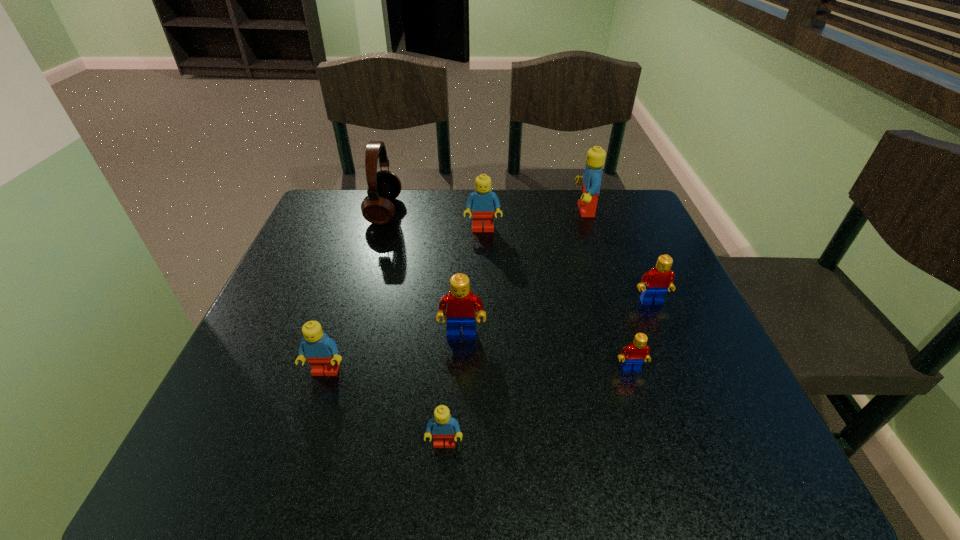
Where is `free space between the black headset and the leftmost red Lego`? free space between the black headset and the leftmost red Lego is located at coordinates (423, 273).

Locate an element on the screen. vacant area that lies between the smallest blue Lego and the leftmost red Lego is located at coordinates (453, 389).

The width and height of the screenshot is (960, 540). Identify the location of vacant space that's between the fourth nearest object and the black headset. pos(423,273).

Where is `object that is the seventh nearest to the second farthest Lego`? object that is the seventh nearest to the second farthest Lego is located at coordinates (443, 426).

I want to click on object that can be found as the closest to the nearest object, so tap(321, 351).

Point out which Lego is positioned as the sixth nearest to the biggest blue Lego. Please provide its 2D coordinates. Your answer should be formatted as a tuple, i.e. [(x, y)], where the tuple contains the x and y coordinates of a point satisfying the conditions above.

[(321, 351)]

What are the coordinates of `Lego that is the fourth nearest to the nearest Lego` in the screenshot? It's located at click(x=660, y=278).

Select which blue Lego is the second closest to the smallest blue Lego. Please provide its 2D coordinates. Your answer should be formatted as a tuple, i.e. [(x, y)], where the tuple contains the x and y coordinates of a point satisfying the conditions above.

[(482, 201)]

Select which blue Lego is the second closest to the nearest object. Please provide its 2D coordinates. Your answer should be formatted as a tuple, i.e. [(x, y)], where the tuple contains the x and y coordinates of a point satisfying the conditions above.

[(482, 201)]

You are a GUI agent. You are given a task and a screenshot of the screen. Output one action in this format:
    pyautogui.click(x=<x>, y=<y>)
    Task: Click on the red Lego that stands as the second closest to the third biggest blue Lego
    The width and height of the screenshot is (960, 540).
    Given the screenshot: What is the action you would take?
    pyautogui.click(x=632, y=356)